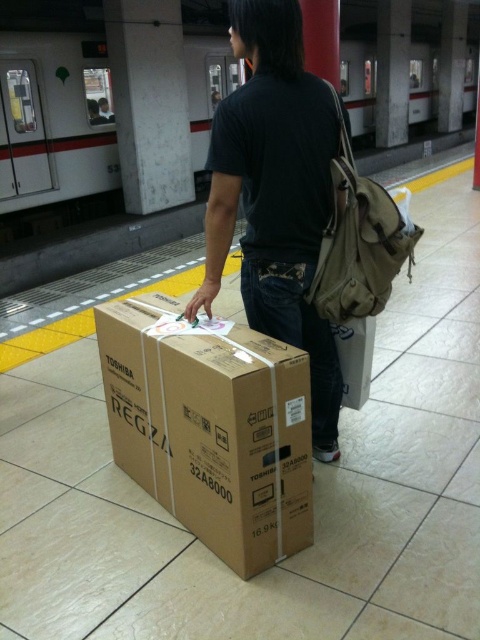
You are a delivery person who needs to locate the brown cardboard box at center on the platform. According to the coordinates provided, where should you look to find it?

The brown cardboard box at center is located at the coordinates point (211, 428).

You are a delivery person who needs to hand over a package to the recipient. You see a black cotton shirt at center and a khaki canvas backpack at right. Which item is closer to you so you can address the person wearing them?

The black cotton shirt at center is closer to the viewer than the khaki canvas backpack at right, so you should address the person by referring to the black cotton shirt at center since it is nearer to you.